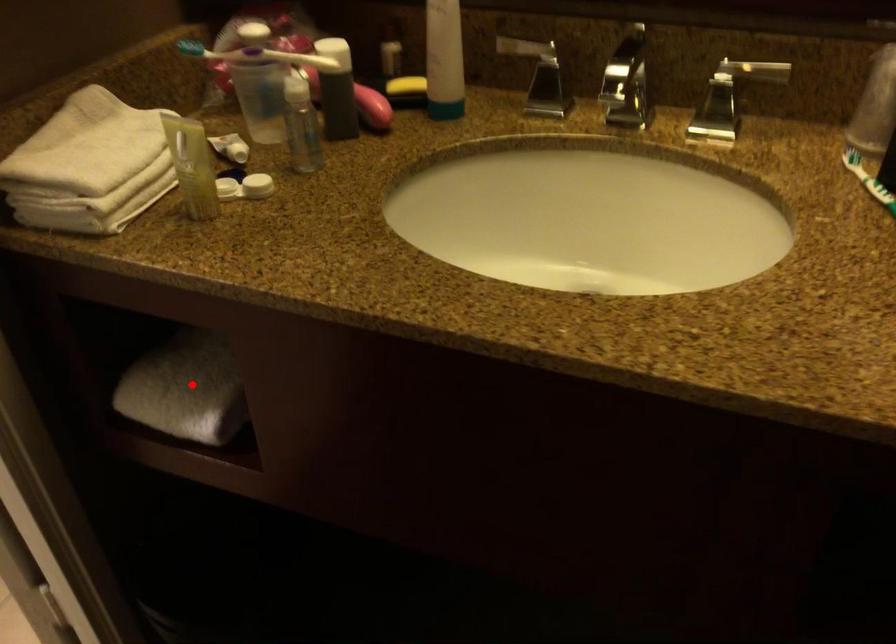
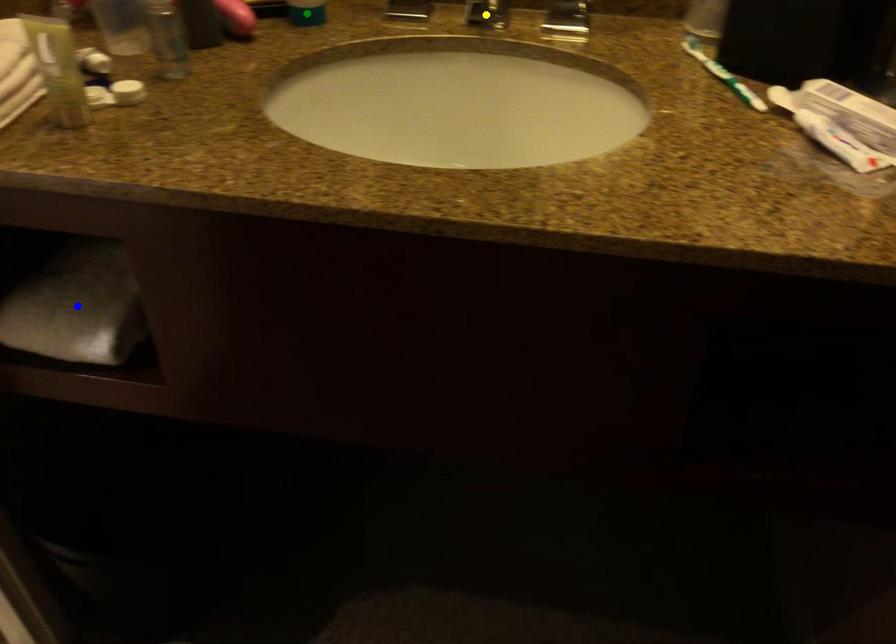
Question: I am providing you with two images of the same scene from different viewpoints. A red point is marked on the first image. You are given multiple points on the second image. Which point in image 2 represents the same 3d spot as the red point in image 1?

Choices:
 (A) green point
 (B) blue point
 (C) yellow point

Answer: (B)